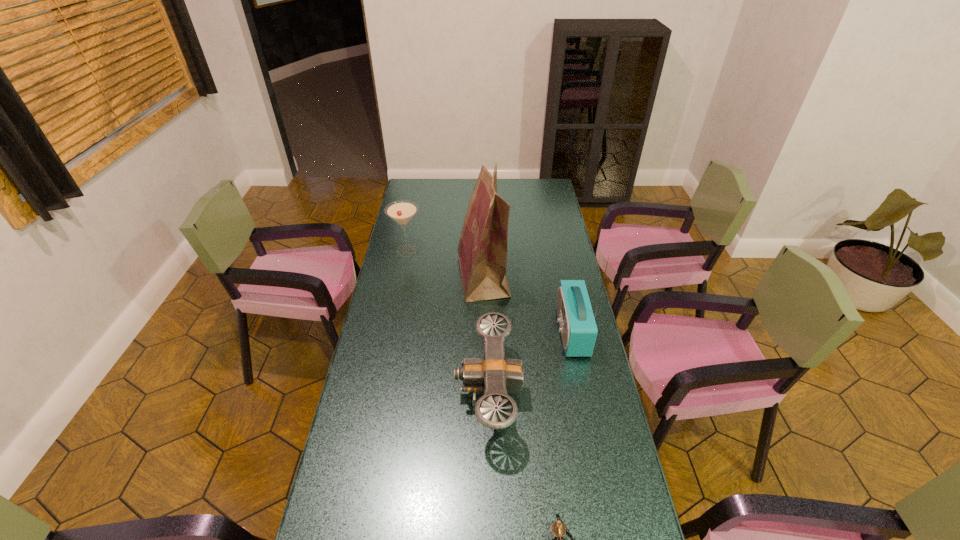
The image size is (960, 540). I want to click on grocery bag, so click(x=482, y=250).

You are a GUI agent. You are given a task and a screenshot of the screen. Output one action in this format:
    pyautogui.click(x=<x>, y=<y>)
    Task: Click on the radio receiver
    This screenshot has width=960, height=540.
    Given the screenshot: What is the action you would take?
    pyautogui.click(x=578, y=328)

The image size is (960, 540). Identify the location of the leftmost object. (402, 211).

You are a GUI agent. You are given a task and a screenshot of the screen. Output one action in this format:
    pyautogui.click(x=<x>, y=<y>)
    Task: Click on the third shortest object
    
    Given the screenshot: What is the action you would take?
    pyautogui.click(x=402, y=211)

In order to click on drone in this screenshot , I will do `click(494, 374)`.

The height and width of the screenshot is (540, 960). In order to click on free space located 0.230m on the front-facing side of the grocery bag in this screenshot , I will do `click(403, 276)`.

The image size is (960, 540). In order to click on vacant space located 0.050m on the front-facing side of the grocery bag in this screenshot , I will do tap(444, 276).

This screenshot has width=960, height=540. Identify the location of vacant point located 0.320m on the front-facing side of the grocery bag. (382, 276).

The height and width of the screenshot is (540, 960). I want to click on free space located on the front panel of the radio receiver, so click(x=520, y=331).

I want to click on vacant space positioned on the front panel of the radio receiver, so click(x=499, y=331).